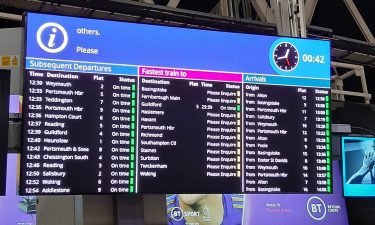
You are a GUI agent. You are given a task and a screenshot of the screen. Output one action in this format:
    pyautogui.click(x=<x>, y=<y>)
    Task: Click on the silver cabinet
    
    Given the screenshot: What is the action you would take?
    pyautogui.click(x=13, y=141)